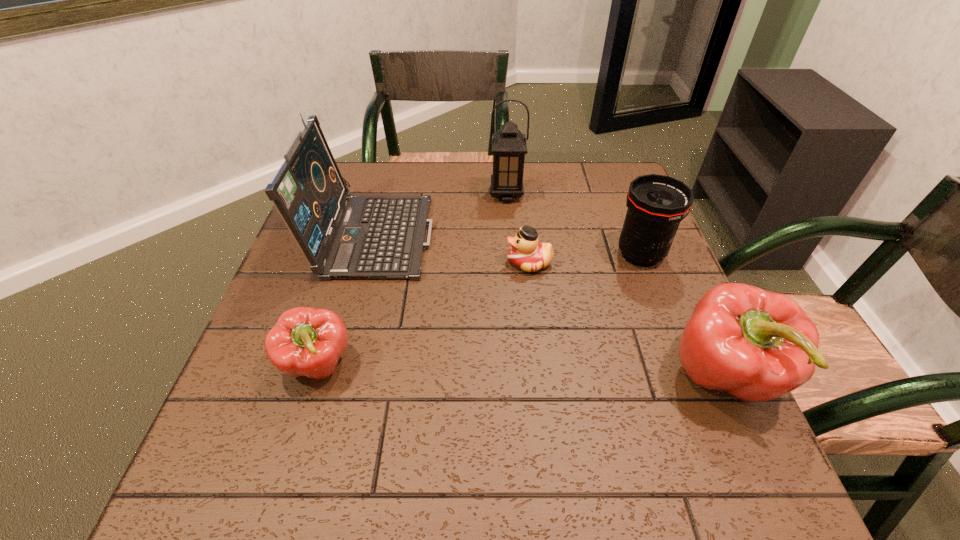
Identify which object is located as the fifth nearest to the telephoto lens. Please provide its 2D coordinates. Your answer should be formatted as a tuple, i.e. [(x, y)], where the tuple contains the x and y coordinates of a point satisfying the conditions above.

[(305, 341)]

At what (x,y) coordinates should I click in order to perform the action: click on free location that satisfies the following two spatial constraints: 1. on the back side of the second shortest object; 2. on the left side of the lantern. Please return your answer as a coordinate pair (x, y). Image resolution: width=960 pixels, height=540 pixels. Looking at the image, I should click on (371, 195).

Where is `vacant space that satisfies the following two spatial constraints: 1. on the front-facing side of the telephoto lens; 2. on the left side of the laptop computer`? The height and width of the screenshot is (540, 960). vacant space that satisfies the following two spatial constraints: 1. on the front-facing side of the telephoto lens; 2. on the left side of the laptop computer is located at coordinates (369, 254).